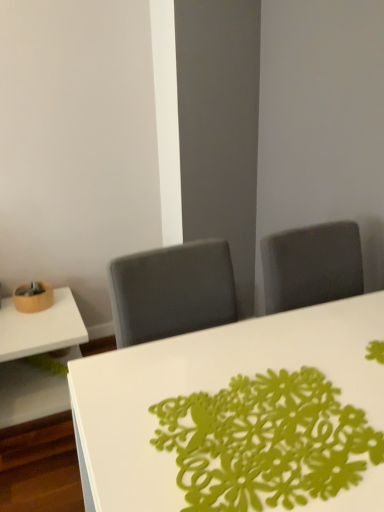
Identify the location of free point behind green paper doily at center. (275, 340).